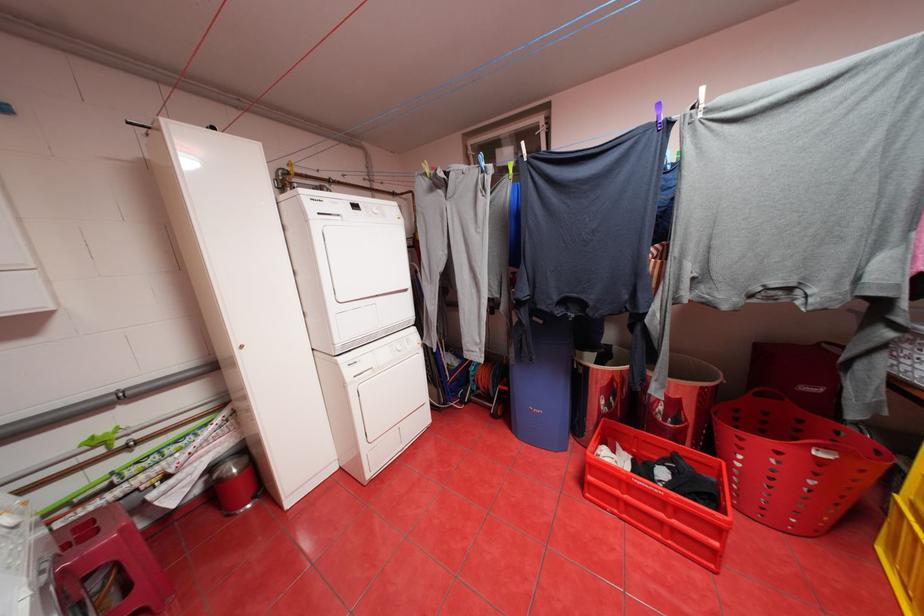
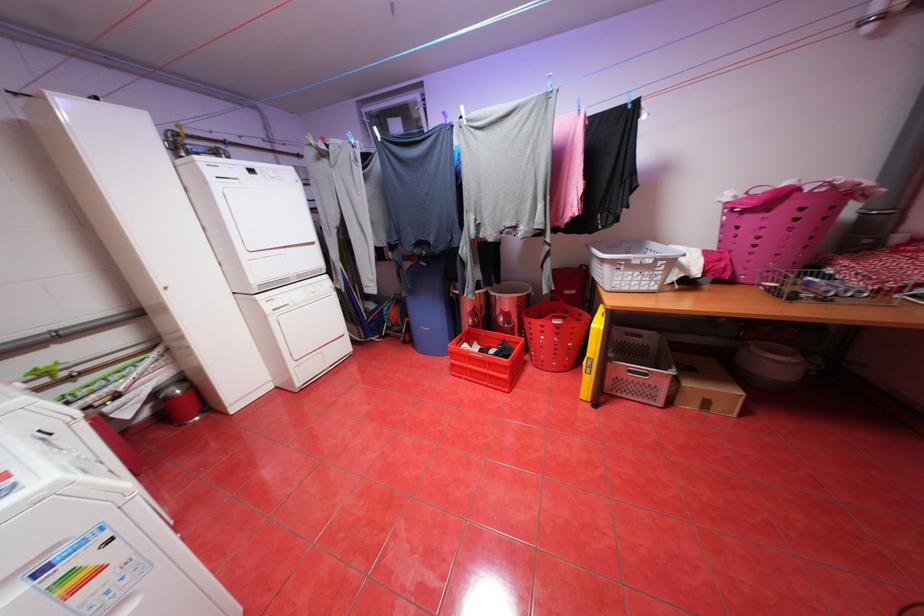
Question: I am providing you with two images of the same scene from different viewpoints. Which of the following objects are not visible in image2?

Choices:
 (A) wire basket
 (B) grey crate handle
 (C) yellow level tool
 (D) none of these

Answer: (D)